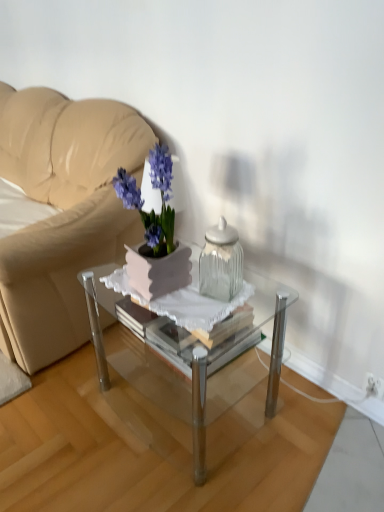
The width and height of the screenshot is (384, 512). In order to click on free space that is to the left of clear glass coffee table at center in this screenshot , I will do `click(67, 414)`.